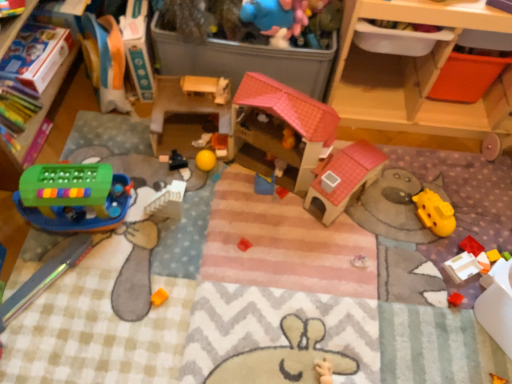
Identify the location of vacant region in front of yellow rubber ball at center, which appears as the sixth toy when viewed from the left. (215, 187).